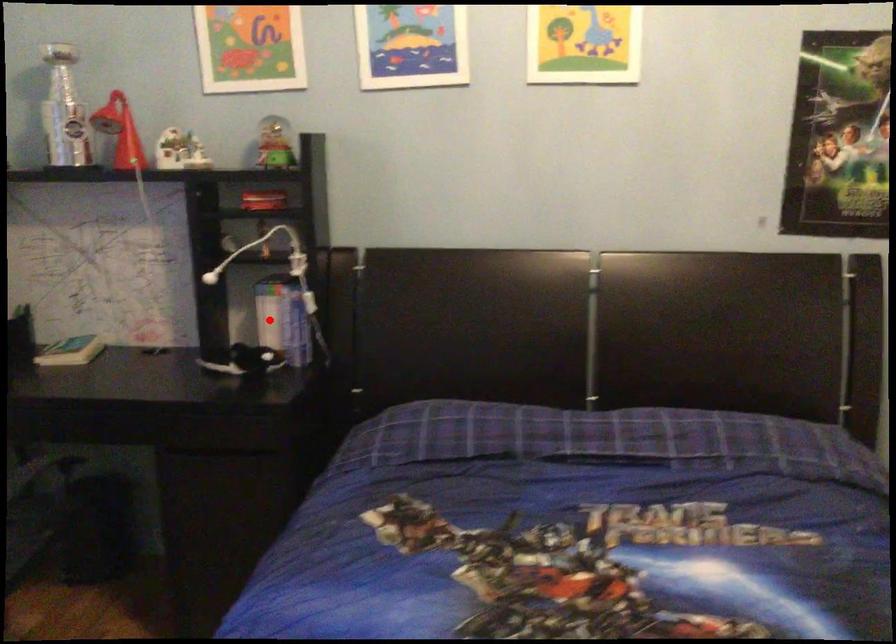
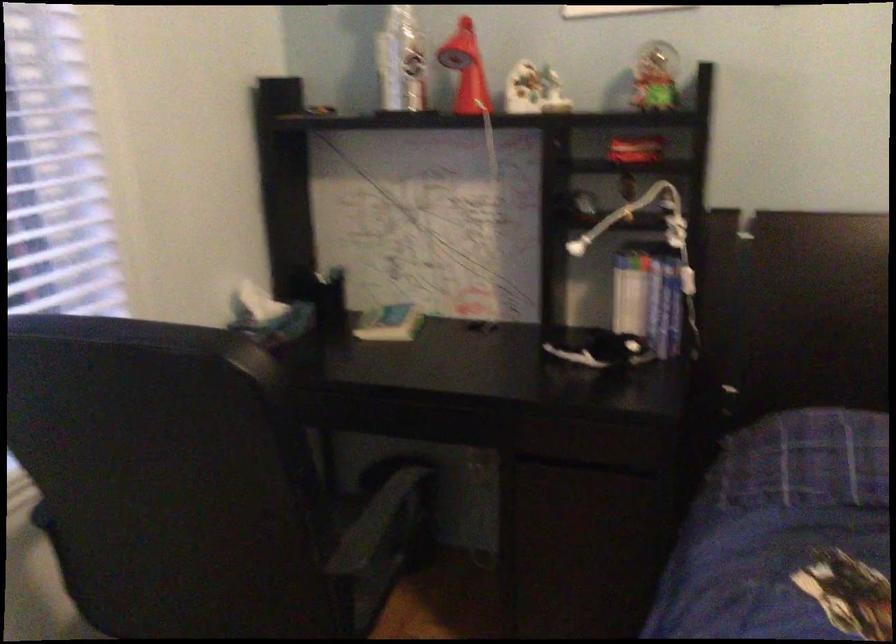
Question: I am providing you with two images of the same scene from different viewpoints. Given a red point in image1, look at the same physical point in image2. Is it:

Choices:
 (A) Closer to the viewpoint
 (B) Farther from the viewpoint

Answer: (A)